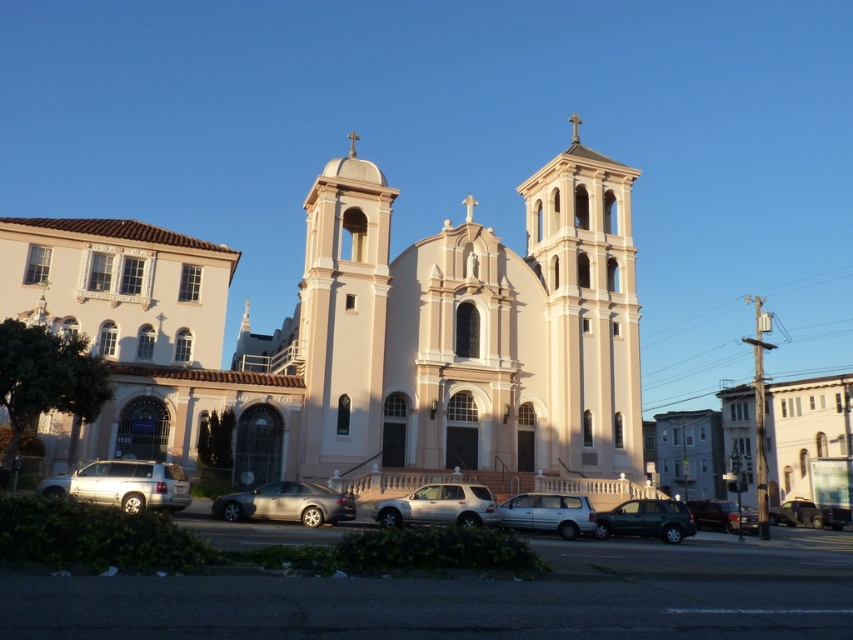
You are standing in front of the grand church and want to take a photo of the point marked at coordinates point (44, 488). If your camera has a maximum focus range of 130 feet, will you be able to capture it clearly?

The point (44, 488) is 132.32 feet away from the camera, which exceeds the maximum focus range of 130 feet. Therefore, you won not be able to capture it clearly.

You are a photographer planning to take a picture of the church from the front. You have a silver metallic suv at lower left and a satin silver sedan at center in the foreground. Which vehicle should you move to ensure the church is fully visible in your photo?

You should move the silver metallic suv at lower left because it is larger in size compared to the satin silver sedan at center, so removing the larger vehicle would allow a clearer view of the church.

You are a photographer planning to take a picture of the grand church. You want to include both the silver metallic suv at lower left and the matte black suv at center in your shot. Which SUV should you position closer to the camera to ensure both are visible without cropping?

You should position the silver metallic suv at lower left closer to the camera since it is larger in size compared to the matte black suv at center. This way, both SUVs will fit within the frame without cropping.